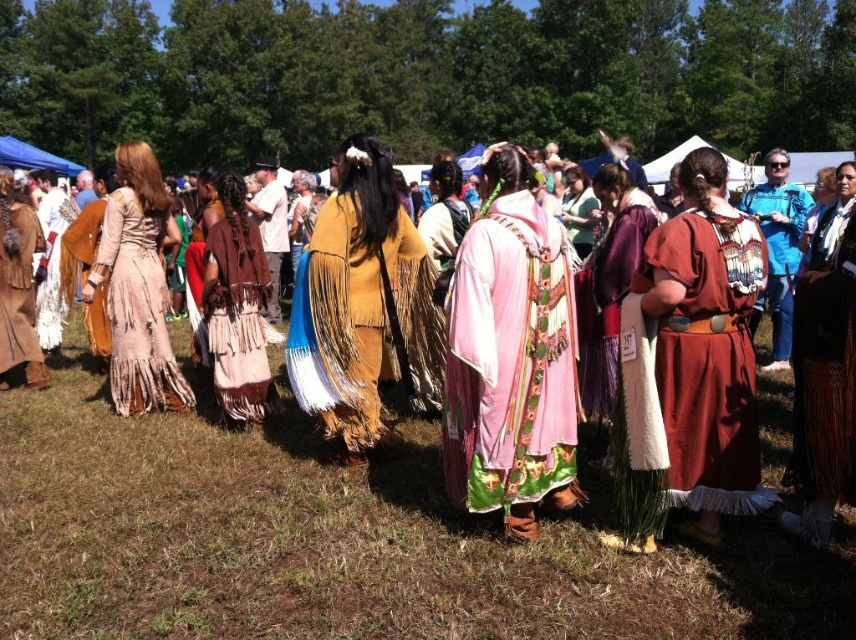
You are an event photographer at the powwow. You want to capture a photo that includes both the matte red dress at center and the blue denim jacket at upper right. Based on their positions, which object should you place on the left side of your camera frame?

The matte red dress at center should be placed on the left side of your camera frame because it is positioned on the left side of the blue denim jacket at upper right.

You are a photographer standing at a certain distance from the matte red dress at center. If your camera has a focal length of 50mm and you want to capture the dress in focus, what adjustment should you make to your camera settings?

The matte red dress at center is 10.90 feet from the camera. To ensure the dress is in focus, you should adjust the camera focus to 10.90 feet.

You are an observer standing in front of the group. You notice the matte yellow dress at center and the matte brown leather dress at left. Which dress is closer to you?

The matte yellow dress at center is closer to you because it is positioned under the matte brown leather dress at left, indicating it is in front.